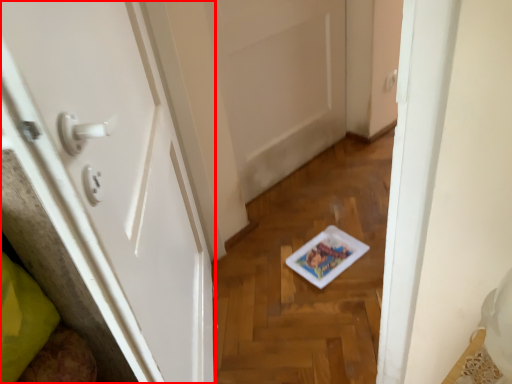
Question: Where is door (annotated by the red box) located in relation to door in the image?

Choices:
 (A) right
 (B) left

Answer: (B)